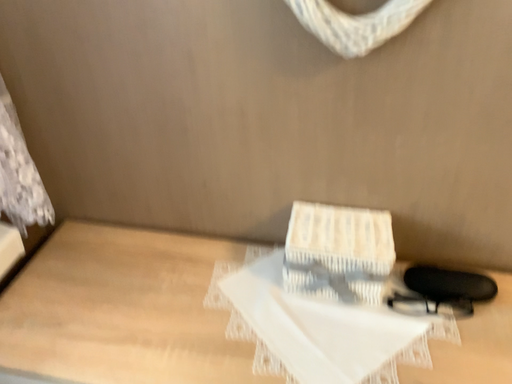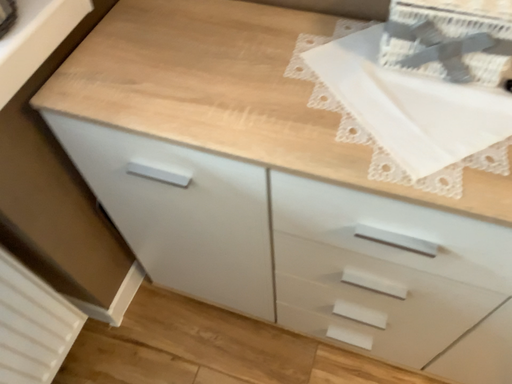
Question: How did the camera likely rotate when shooting the video?

Choices:
 (A) rotated right
 (B) rotated left

Answer: (B)